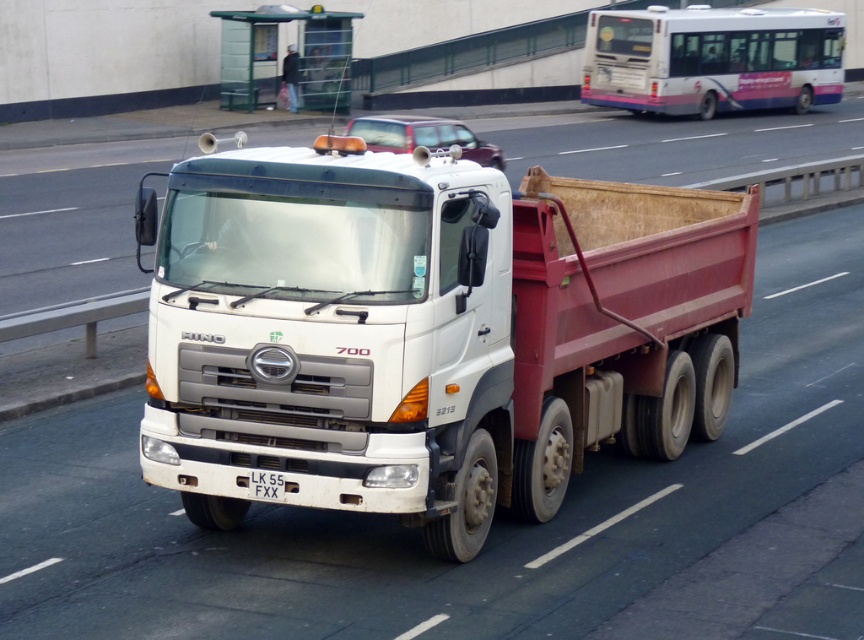
Can you confirm if metallic red car at center is positioned below white plastic license plate at center?

Actually, metallic red car at center is above white plastic license plate at center.

This screenshot has width=864, height=640. What do you see at coordinates (423, 136) in the screenshot? I see `metallic red car at center` at bounding box center [423, 136].

This screenshot has width=864, height=640. In order to click on metallic red car at center in this screenshot , I will do `click(423, 136)`.

Is white matte truck at center shorter than metallic red car at center?

Yes, white matte truck at center is shorter than metallic red car at center.

Which is behind, point (391, 337) or point (453, 131)?

Positioned behind is point (453, 131).

Find the location of a particular element. This screenshot has height=640, width=864. white matte truck at center is located at coordinates (429, 332).

Can you confirm if white matte truck at center is smaller than white plastic license plate at center?

No.

Describe the element at coordinates (429, 332) in the screenshot. I see `white matte truck at center` at that location.

Identify the location of white matte truck at center. The image size is (864, 640). (429, 332).